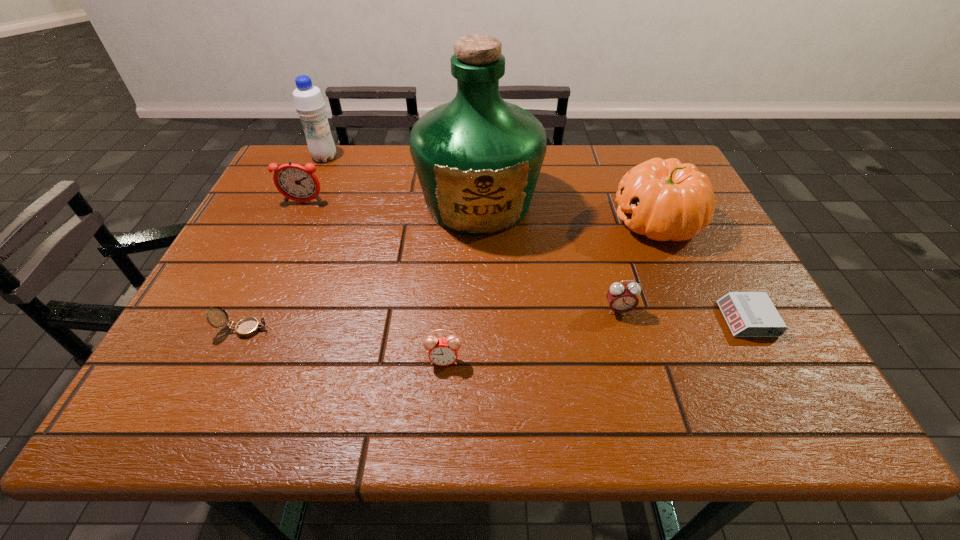
Image resolution: width=960 pixels, height=540 pixels. Find the location of `vacant region between the third alarm clock from left to right and the tallest object`. vacant region between the third alarm clock from left to right and the tallest object is located at coordinates (548, 257).

In order to click on vacant area that lies between the shortest object and the seventh shortest object in this screenshot , I will do `click(536, 239)`.

Locate which object ranks sixth in proximity to the pumpkin. Please provide its 2D coordinates. Your answer should be formatted as a tuple, i.e. [(x, y)], where the tuple contains the x and y coordinates of a point satisfying the conditions above.

[(308, 100)]

Identify which object is the second closest to the second alarm clock from left to right. Please provide its 2D coordinates. Your answer should be formatted as a tuple, i.e. [(x, y)], where the tuple contains the x and y coordinates of a point satisfying the conditions above.

[(478, 158)]

The width and height of the screenshot is (960, 540). I want to click on the closest alarm clock relative to the fourth tallest object, so click(443, 351).

Locate an element on the screen. alarm clock that is the third closest one to the liquor is located at coordinates (443, 351).

The height and width of the screenshot is (540, 960). In order to click on free location that satisfies the following two spatial constraints: 1. on the front side of the shortest object; 2. on the face of the compass in this screenshot , I will do `click(752, 329)`.

Locate an element on the screen. free space that satisfies the following two spatial constraints: 1. on the carved face of the pumpkin; 2. on the clock face of the third alarm clock from left to right is located at coordinates (695, 310).